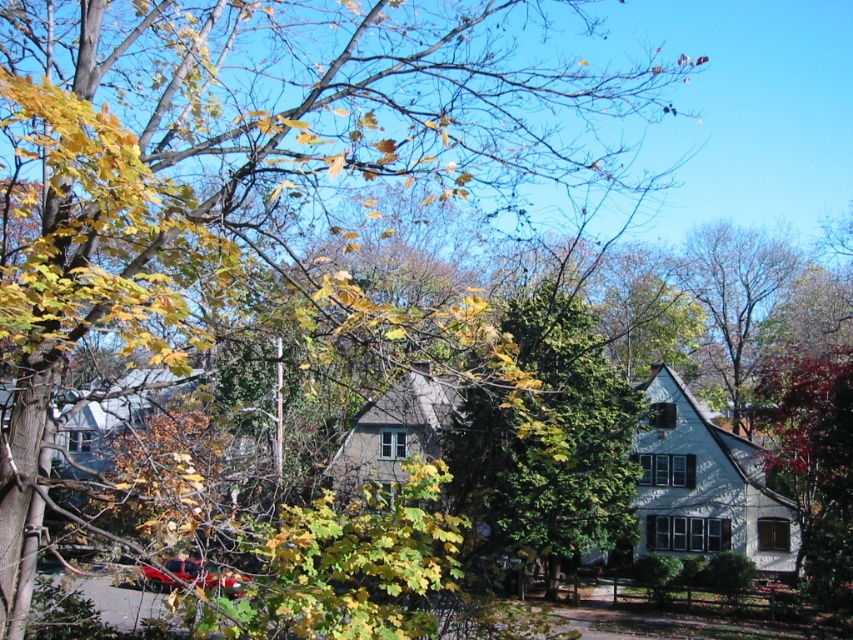
You are standing in the suburban scene described. There is a point marked at coordinates (544,442). What object is located at that point?

The point at coordinates (544,442) marks the green textured tree at center.

You are a painter wanting to capture the suburban scene. You have a canvas that can fit the width of the green textured tree at center. Can you also paint the green leafy tree at upper right on the same canvas without cropping it?

The green textured tree at center is narrower than the green leafy tree at upper right, so the canvas may not be wide enough to include the entire green leafy tree at upper right without cropping.

You are standing in the suburban area and want to determine which tree is taller between the green textured tree at center and the green leafy tree at upper right. Based on the scene, which one is taller?

The green leafy tree at upper right is taller than the green textured tree at center.